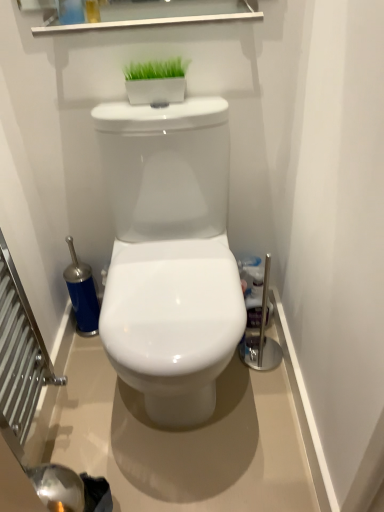
Find the location of `vacant point above brushed metal medicine cabinet at upper center (from a real-world perspective)`. vacant point above brushed metal medicine cabinet at upper center (from a real-world perspective) is located at coordinates (139, 13).